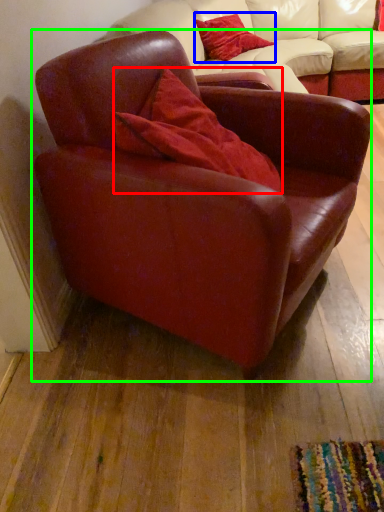
Question: Considering the real-world distances, which object is farthest from pillow (highlighted by a red box)? pillow (highlighted by a blue box) or chair (highlighted by a green box)?

Choices:
 (A) pillow
 (B) chair

Answer: (A)